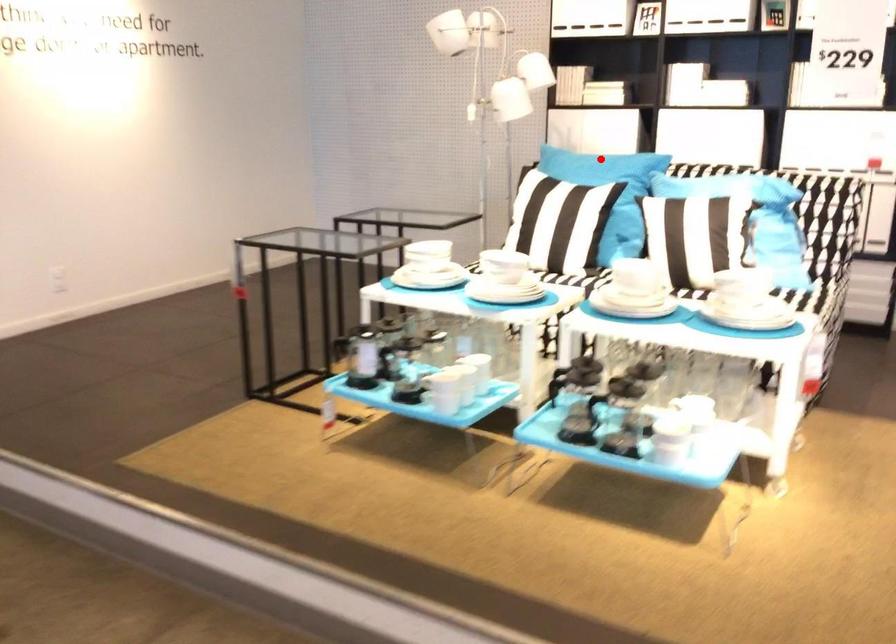
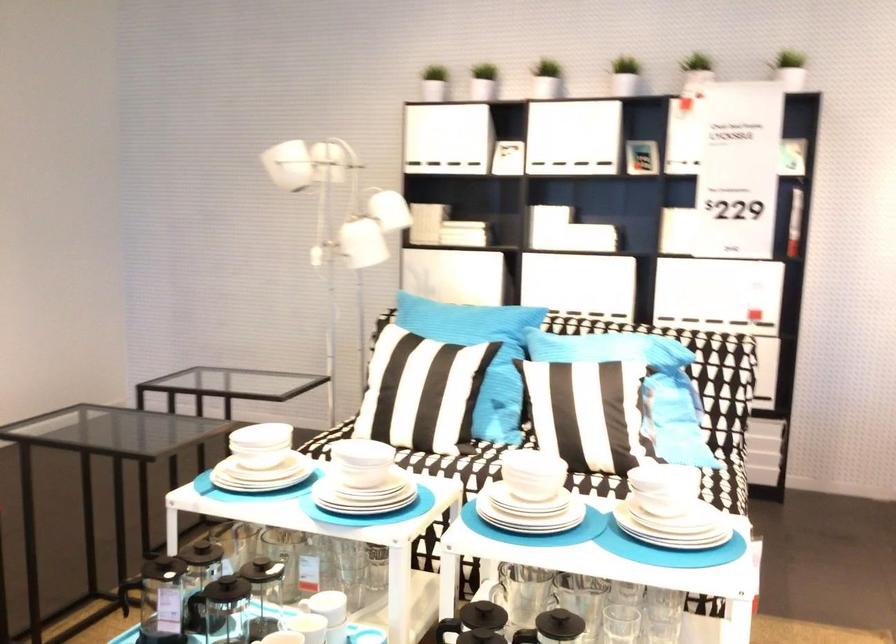
In the second image, find the point that corresponds to the highlighted location in the first image.

(467, 324)